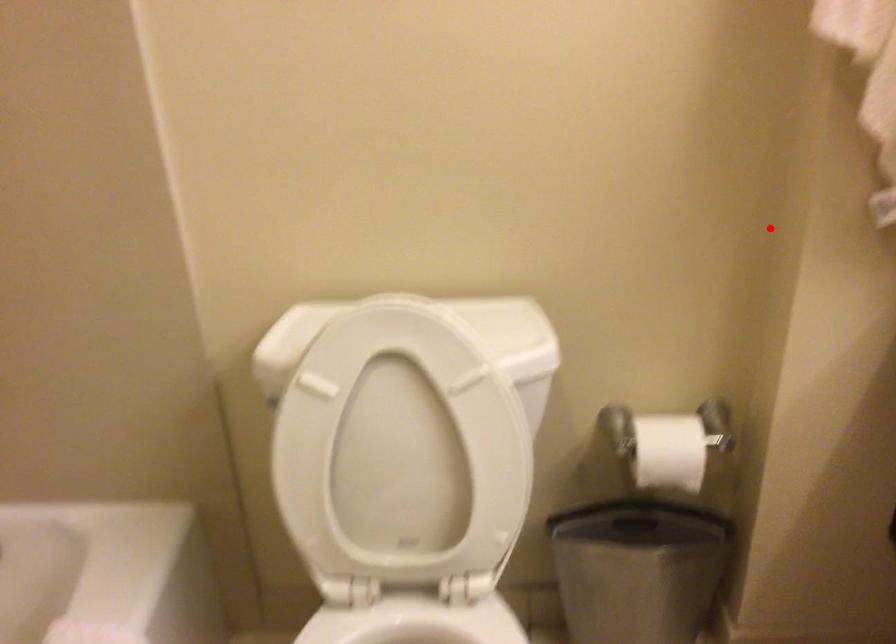
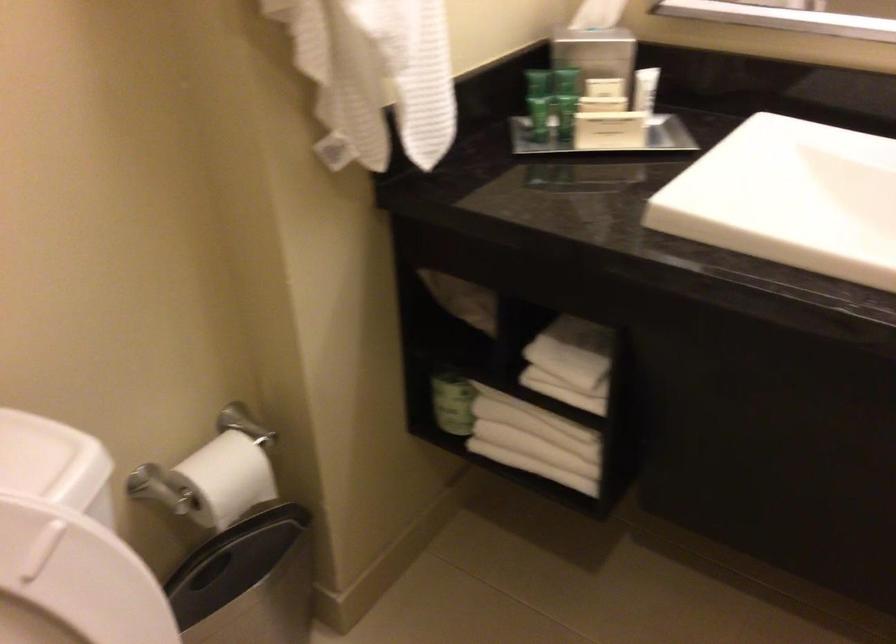
Locate, in the second image, the point that corresponds to the highlighted location in the first image.

(218, 210)